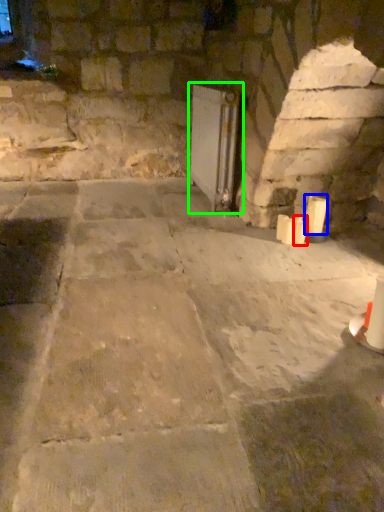
Question: Which object is the farthest from candle (highlighted by a red box)? Choose among these: candle (highlighted by a blue box) or fireplace (highlighted by a green box).

Choices:
 (A) candle
 (B) fireplace

Answer: (B)